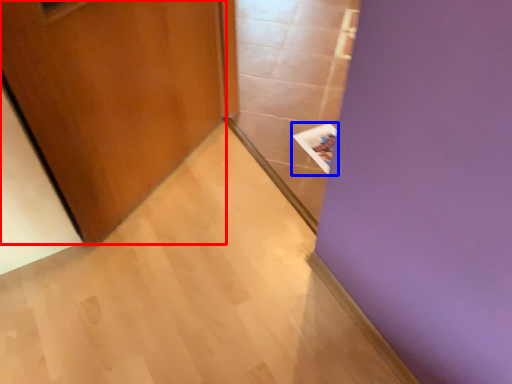
Question: Among these objects, which one is farthest to the camera, door (highlighted by a red box) or magazine (highlighted by a blue box)?

Choices:
 (A) door
 (B) magazine

Answer: (B)